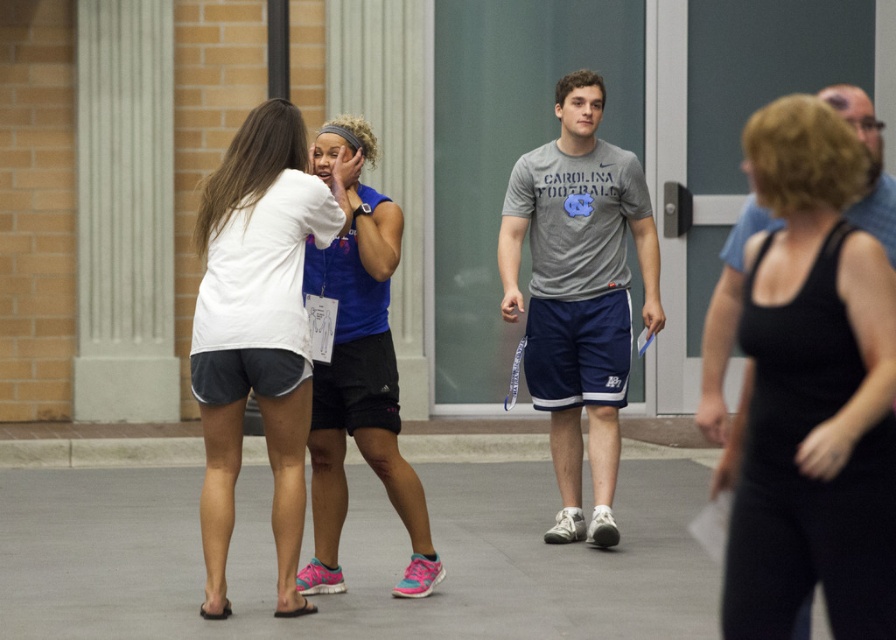
You are standing at the entrance of the gymnasium and see the gray concrete pavement at lower center and the blue athletic tank top at center. Which object is wider from your perspective?

The gray concrete pavement at lower center is wider than the blue athletic tank top at center.